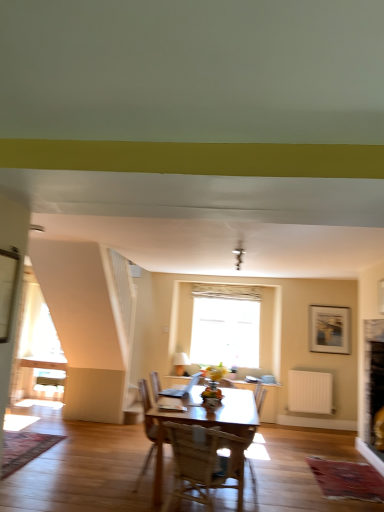
Question: Are wooden framed picture at upper right and white fabric lampshade at upper center making contact?

Choices:
 (A) no
 (B) yes

Answer: (A)

Question: Is wooden framed picture at upper right completely or partially outside of white fabric lampshade at upper center?

Choices:
 (A) no
 (B) yes

Answer: (B)

Question: From a real-world perspective, does wooden framed picture at upper right sit lower than white fabric lampshade at upper center?

Choices:
 (A) no
 (B) yes

Answer: (A)

Question: Is wooden framed picture at upper right at the left side of white fabric lampshade at upper center?

Choices:
 (A) no
 (B) yes

Answer: (A)

Question: Is wooden framed picture at upper right in front of white fabric lampshade at upper center?

Choices:
 (A) yes
 (B) no

Answer: (A)

Question: In terms of size, does wooden chair at center appear bigger or smaller than wooden framed picture at upper right?

Choices:
 (A) big
 (B) small

Answer: (A)

Question: Relative to wooden framed picture at upper right, is wooden chair at center in front or behind?

Choices:
 (A) front
 (B) behind

Answer: (A)

Question: Visually, is wooden chair at center positioned to the left or to the right of wooden framed picture at upper right?

Choices:
 (A) right
 (B) left

Answer: (B)

Question: Is wooden chair at center wider or thinner than wooden framed picture at upper right?

Choices:
 (A) wide
 (B) thin

Answer: (A)

Question: Choose the correct answer: Is white plastic radiator at lower right inside wooden framed picture at upper right or outside it?

Choices:
 (A) inside
 (B) outside

Answer: (B)

Question: From their relative heights in the image, would you say white plastic radiator at lower right is taller or shorter than wooden framed picture at upper right?

Choices:
 (A) tall
 (B) short

Answer: (B)

Question: From the image's perspective, is white plastic radiator at lower right above or below wooden framed picture at upper right?

Choices:
 (A) below
 (B) above

Answer: (A)

Question: From a real-world perspective, relative to wooden framed picture at upper right, is white plastic radiator at lower right vertically above or below?

Choices:
 (A) above
 (B) below

Answer: (B)

Question: Do you think white fabric lampshade at upper center is within white plastic radiator at lower right, or outside of it?

Choices:
 (A) outside
 (B) inside

Answer: (A)

Question: Looking at their shapes, would you say white fabric lampshade at upper center is wider or thinner than white plastic radiator at lower right?

Choices:
 (A) wide
 (B) thin

Answer: (A)